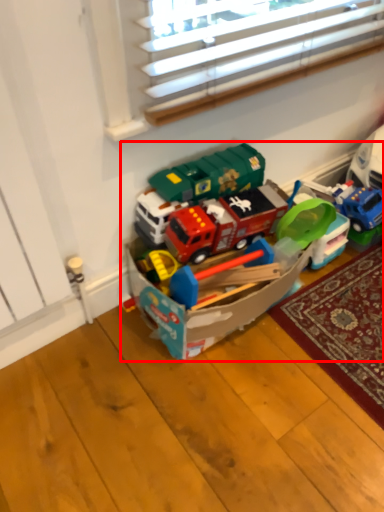
Question: From the image's perspective, what is the correct spatial relationship of toy (annotated by the red box) in relation to toy?

Choices:
 (A) below
 (B) above

Answer: (A)